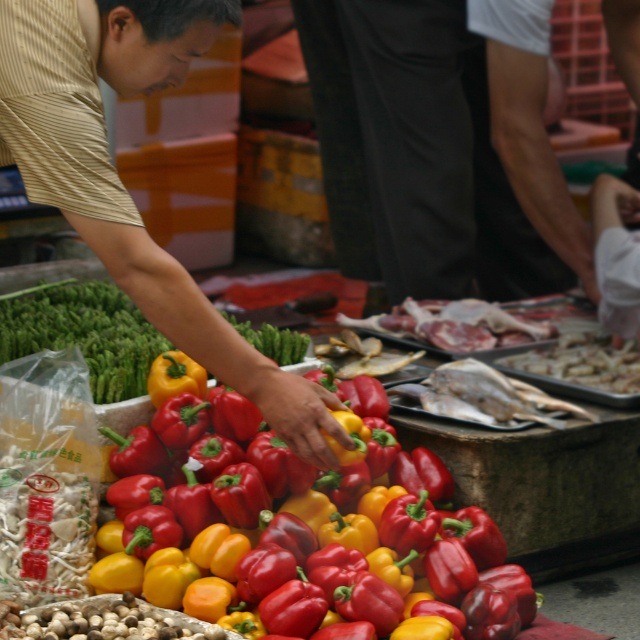
You are a customer at the market and want to pick up the shiny silver tray at center. Which direction should you move your hand relative to the yellow matte bell pepper at center to reach it?

The shiny silver tray at center is to the right of the yellow matte bell pepper at center, so you should move your hand to the right of the yellow matte bell pepper at center to reach it.

You are a customer at a market and want to pick up the yellow matte bell pepper at center. Where exactly should you look for it?

The yellow matte bell pepper at center is located at point (310, 540).